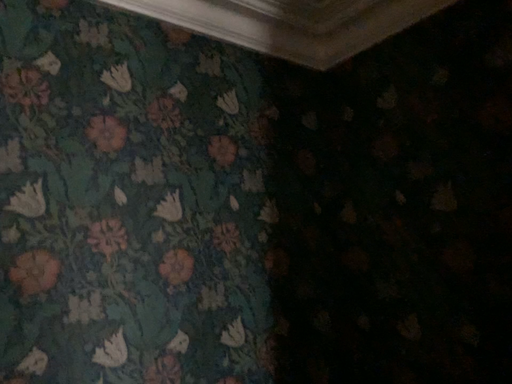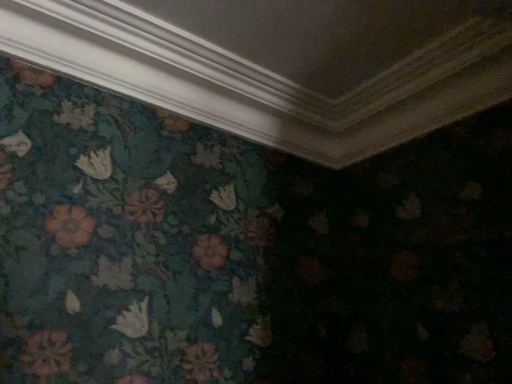
Question: Which way did the camera rotate in the video?

Choices:
 (A) rotated upward
 (B) rotated downward

Answer: (A)